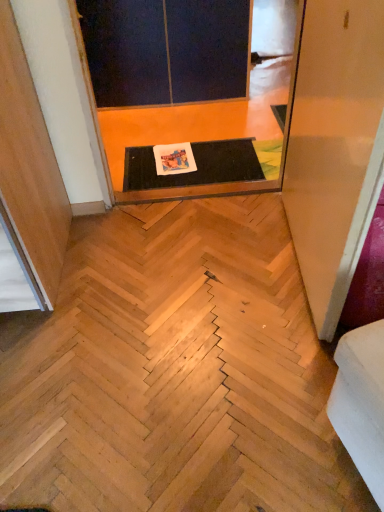
At what (x,y) coordinates should I click in order to perform the action: click on transparent plastic screen door at upper right, placed as the 3th screen door when sorted from back to front. Please return your answer as a coordinate pair (x, y). The height and width of the screenshot is (512, 384). Looking at the image, I should click on (335, 148).

What is the approximate width of natural wood stairwell at center?

It is 1.39 meters.

You are a GUI agent. You are given a task and a screenshot of the screen. Output one action in this format:
    pyautogui.click(x=<x>, y=<y>)
    Task: Click on the white fabric couch at lower right
    
    Given the screenshot: What is the action you would take?
    pyautogui.click(x=361, y=402)

Identify the location of black rubber mat at center, which ranks as the second screen door in front-to-back order. The height and width of the screenshot is (512, 384). (186, 187).

Image resolution: width=384 pixels, height=512 pixels. Identify the location of transparent plastic screen door at upper right, the first screen door when ordered from front to back. (335, 148).

Locate an element on the screen. the 1st screen door behind when counting from the natural wood stairwell at center is located at coordinates (186, 187).

Considering the positions of point (121, 297) and point (80, 57), is point (121, 297) closer or farther from the camera than point (80, 57)?

Point (121, 297).

Can you confirm if natural wood stairwell at center is taller than black rubber mat at center, which ranks as the second screen door in front-to-back order?

No.

Is natural wood stairwell at center positioned with its back to black rubber mat at center, which ranks as the second screen door in front-to-back order?

No, natural wood stairwell at center's orientation is not away from black rubber mat at center, which ranks as the second screen door in front-to-back order.

Can you see dark matte screen door at upper center, acting as the third screen door starting from the front, touching natural wood stairwell at center?

They are not placed beside each other.

Does dark matte screen door at upper center, arranged as the first screen door when viewed from the back, contain natural wood stairwell at center?

No, dark matte screen door at upper center, arranged as the first screen door when viewed from the back, does not contain natural wood stairwell at center.

Considering the relative sizes of dark matte screen door at upper center, acting as the third screen door starting from the front, and natural wood stairwell at center in the image provided, is dark matte screen door at upper center, acting as the third screen door starting from the front, thinner than natural wood stairwell at center?

Yes.

Is dark matte screen door at upper center, acting as the third screen door starting from the front, oriented away from natural wood stairwell at center?

No.

In the image, is natural wood stairwell at center on the left side or the right side of transparent plastic screen door at upper right, the first screen door when ordered from front to back?

natural wood stairwell at center is to the left of transparent plastic screen door at upper right, the first screen door when ordered from front to back.

Is natural wood stairwell at center further to the viewer compared to transparent plastic screen door at upper right, the first screen door when ordered from front to back?

That is True.

Which is in front, point (184, 397) or point (381, 126)?

The point (381, 126) is closer to the camera.

Which of these two, natural wood stairwell at center or transparent plastic screen door at upper right, the first screen door when ordered from front to back, is bigger?

transparent plastic screen door at upper right, the first screen door when ordered from front to back, is bigger.

This screenshot has width=384, height=512. I want to click on furniture located underneath the transparent plastic screen door at upper right, placed as the 3th screen door when sorted from back to front (from a real-world perspective), so click(x=361, y=402).

Looking at this image, which is in front, white fabric couch at lower right or transparent plastic screen door at upper right, the first screen door when ordered from front to back?

transparent plastic screen door at upper right, the first screen door when ordered from front to back.

Visually, is white fabric couch at lower right positioned to the left or to the right of transparent plastic screen door at upper right, the first screen door when ordered from front to back?

From the image, it's evident that white fabric couch at lower right is to the right of transparent plastic screen door at upper right, the first screen door when ordered from front to back.

Is white fabric couch at lower right bigger than transparent plastic screen door at upper right, placed as the 3th screen door when sorted from back to front?

Incorrect, white fabric couch at lower right is not larger than transparent plastic screen door at upper right, placed as the 3th screen door when sorted from back to front.

How distant is white fabric couch at lower right from black rubber mat at center, which ranks as the second screen door in front-to-back order?

A distance of 1.21 meters exists between white fabric couch at lower right and black rubber mat at center, which ranks as the second screen door in front-to-back order.

From a real-world perspective, is white fabric couch at lower right located higher than black rubber mat at center, which ranks as the second screen door in front-to-back order?

Yes.

Who is shorter, white fabric couch at lower right or black rubber mat at center, which appears as the second screen door when viewed from the back?

Standing shorter between the two is black rubber mat at center, which appears as the second screen door when viewed from the back.

Can you confirm if white fabric couch at lower right is positioned to the left of black rubber mat at center, which ranks as the second screen door in front-to-back order?

No, white fabric couch at lower right is not to the left of black rubber mat at center, which ranks as the second screen door in front-to-back order.

Which object is more forward, natural wood stairwell at center or dark matte screen door at upper center, arranged as the first screen door when viewed from the back?

natural wood stairwell at center.

How distant is natural wood stairwell at center from dark matte screen door at upper center, acting as the third screen door starting from the front?

natural wood stairwell at center is 1.65 meters away from dark matte screen door at upper center, acting as the third screen door starting from the front.

Can you confirm if natural wood stairwell at center is smaller than dark matte screen door at upper center, acting as the third screen door starting from the front?

Yes.

In the image, is natural wood stairwell at center on the left side or the right side of dark matte screen door at upper center, arranged as the first screen door when viewed from the back?

natural wood stairwell at center is positioned on dark matte screen door at upper center, arranged as the first screen door when viewed from the back,'s right side.

Between dark matte screen door at upper center, acting as the third screen door starting from the front, and white fabric couch at lower right, which one has smaller width?

white fabric couch at lower right.

Which is correct: dark matte screen door at upper center, acting as the third screen door starting from the front, is inside white fabric couch at lower right, or outside of it?

dark matte screen door at upper center, acting as the third screen door starting from the front, is not inside white fabric couch at lower right, it's outside.

From the image's perspective, who appears lower, dark matte screen door at upper center, arranged as the first screen door when viewed from the back, or white fabric couch at lower right?

white fabric couch at lower right appears lower in the image.

Locate an element on the screen. The image size is (384, 512). the 2nd screen door above the natural wood stairwell at center (from the image's perspective) is located at coordinates (186, 187).

Where is `screen door on the left of natural wood stairwell at center`? The height and width of the screenshot is (512, 384). screen door on the left of natural wood stairwell at center is located at coordinates (165, 50).

Considering their positions, is transparent plastic screen door at upper right, placed as the 3th screen door when sorted from back to front, positioned closer to natural wood stairwell at center than black rubber mat at center, which ranks as the second screen door in front-to-back order?

transparent plastic screen door at upper right, placed as the 3th screen door when sorted from back to front, lies closer to natural wood stairwell at center than the other object.

Based on their spatial positions, is white fabric couch at lower right or natural wood stairwell at center closer to dark matte screen door at upper center, arranged as the first screen door when viewed from the back?

natural wood stairwell at center is closer to dark matte screen door at upper center, arranged as the first screen door when viewed from the back.

Looking at the image, which one is located closer to transparent plastic screen door at upper right, placed as the 3th screen door when sorted from back to front, dark matte screen door at upper center, arranged as the first screen door when viewed from the back, or white fabric couch at lower right?

Based on the image, white fabric couch at lower right appears to be nearer to transparent plastic screen door at upper right, placed as the 3th screen door when sorted from back to front.

Considering their positions, is white fabric couch at lower right positioned closer to black rubber mat at center, which appears as the second screen door when viewed from the back, than dark matte screen door at upper center, acting as the third screen door starting from the front?

dark matte screen door at upper center, acting as the third screen door starting from the front, lies closer to black rubber mat at center, which appears as the second screen door when viewed from the back, than the other object.

Looking at the image, which one is located closer to dark matte screen door at upper center, arranged as the first screen door when viewed from the back, black rubber mat at center, which appears as the second screen door when viewed from the back, or transparent plastic screen door at upper right, placed as the 3th screen door when sorted from back to front?

black rubber mat at center, which appears as the second screen door when viewed from the back, is closer to dark matte screen door at upper center, arranged as the first screen door when viewed from the back.

Looking at the image, which one is located closer to black rubber mat at center, which appears as the second screen door when viewed from the back, dark matte screen door at upper center, acting as the third screen door starting from the front, or natural wood stairwell at center?

natural wood stairwell at center is positioned closer to the anchor black rubber mat at center, which appears as the second screen door when viewed from the back.

From the image, which object appears to be farther from transparent plastic screen door at upper right, the first screen door when ordered from front to back, natural wood stairwell at center or white fabric couch at lower right?

Based on the image, natural wood stairwell at center appears to be further to transparent plastic screen door at upper right, the first screen door when ordered from front to back.

Based on their spatial positions, is transparent plastic screen door at upper right, placed as the 3th screen door when sorted from back to front, or white fabric couch at lower right closer to black rubber mat at center, which ranks as the second screen door in front-to-back order?

transparent plastic screen door at upper right, placed as the 3th screen door when sorted from back to front, is positioned closer to the anchor black rubber mat at center, which ranks as the second screen door in front-to-back order.

Locate an element on the screen. stairwell between transparent plastic screen door at upper right, placed as the 3th screen door when sorted from back to front, and black rubber mat at center, which appears as the second screen door when viewed from the back, along the z-axis is located at coordinates (174, 372).

At what (x,y) coordinates should I click in order to perform the action: click on stairwell between transparent plastic screen door at upper right, the first screen door when ordered from front to back, and white fabric couch at lower right in the up-down direction. Please return your answer as a coordinate pair (x, y). The height and width of the screenshot is (512, 384). Looking at the image, I should click on (174, 372).

This screenshot has height=512, width=384. Identify the location of furniture between transparent plastic screen door at upper right, placed as the 3th screen door when sorted from back to front, and dark matte screen door at upper center, acting as the third screen door starting from the front, from front to back. (361, 402).

Find the location of `stairwell located between white fabric couch at lower right and black rubber mat at center, which ranks as the second screen door in front-to-back order, in the depth direction`. stairwell located between white fabric couch at lower right and black rubber mat at center, which ranks as the second screen door in front-to-back order, in the depth direction is located at coordinates (174, 372).